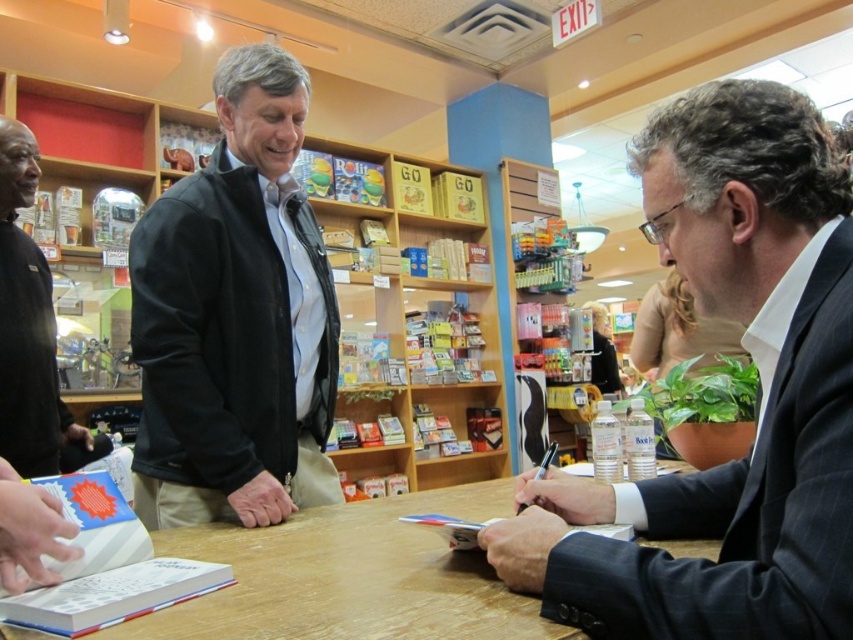
Who is shorter, wooden bookshelf at center or wooden table at center?

Standing shorter between the two is wooden table at center.

Is wooden bookshelf at center bigger than wooden table at center?

Yes.

Which is in front, point (131, 328) or point (459, 582)?

Point (459, 582)

You are a GUI agent. You are given a task and a screenshot of the screen. Output one action in this format:
    pyautogui.click(x=<x>, y=<y>)
    Task: Click on the wooden bookshelf at center
    
    Given the screenshot: What is the action you would take?
    pyautogui.click(x=236, y=317)

How far apart are dark suit at right and wooden bookshelf at center?

dark suit at right is 30.57 inches from wooden bookshelf at center.

Which of these two, dark suit at right or wooden bookshelf at center, stands taller?

With more height is wooden bookshelf at center.

Where is `dark suit at right`? dark suit at right is located at coordinates (758, 396).

Locate an element on the screen. This screenshot has height=640, width=853. dark suit at right is located at coordinates (758, 396).

Between black leather jacket at center and black matte shirt at left, which one has more height?

Standing taller between the two is black leather jacket at center.

Image resolution: width=853 pixels, height=640 pixels. I want to click on black leather jacket at center, so click(235, 317).